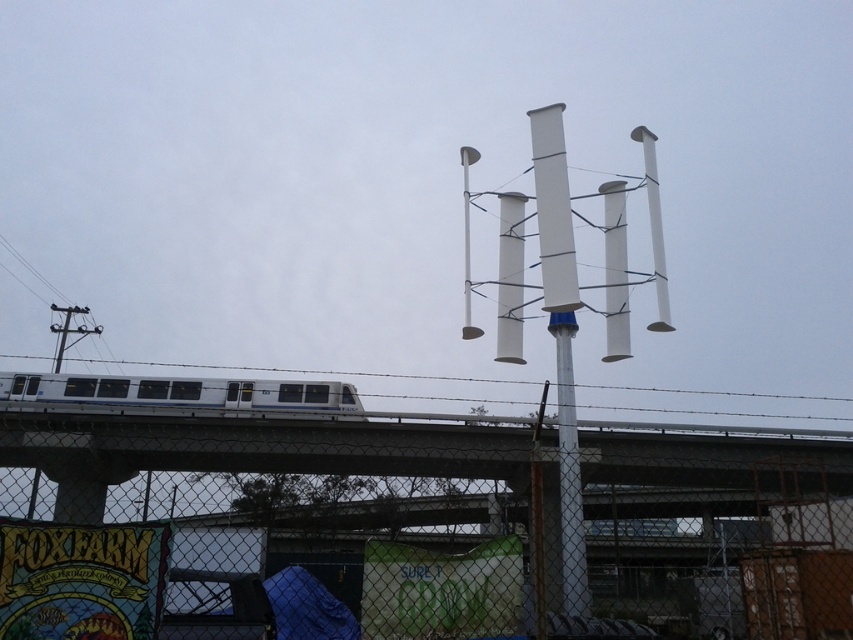
Question: Where is metal chain-link fence at lower center located in relation to white glossy train at center in the image?

Choices:
 (A) above
 (B) below

Answer: (B)

Question: Observing the image, what is the correct spatial positioning of metal chain-link fence at lower center in reference to white glossy train at center?

Choices:
 (A) above
 (B) below

Answer: (B)

Question: Does metal chain-link fence at lower center appear over white glossy train at center?

Choices:
 (A) yes
 (B) no

Answer: (B)

Question: Among these objects, which one is farthest from the camera?

Choices:
 (A) metal chain-link fence at lower center
 (B) white glossy train at center

Answer: (B)

Question: Among these points, which one is farthest from the camera?

Choices:
 (A) (126, 397)
 (B) (190, 420)

Answer: (A)